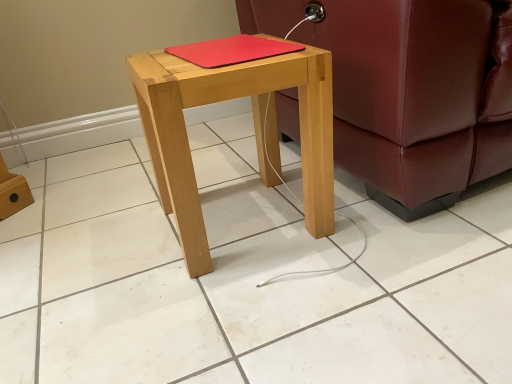
Find the location of a particular element. vacant area that lies to the right of natural wood stool at center is located at coordinates (381, 228).